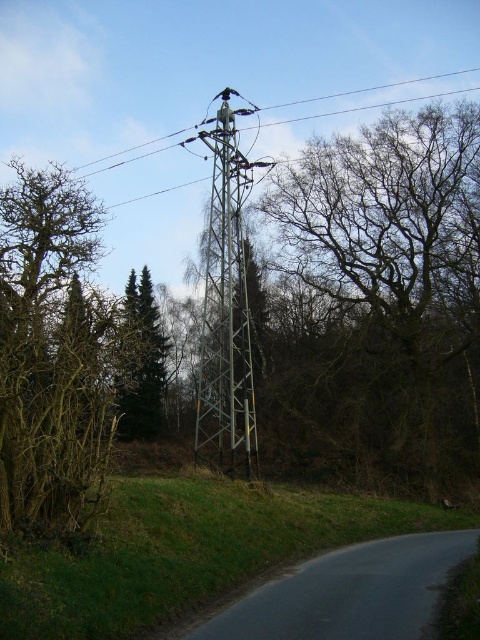
Which is behind, point (452, 205) or point (146, 266)?

The point (146, 266) is more distant.

Is point (363, 428) behind point (122, 416)?

No, it is in front of (122, 416).

This screenshot has width=480, height=640. What are the coordinates of `bare branches at center` in the screenshot? It's located at (391, 285).

Who is positioned more to the right, brown/dry wood at left or green matte tree at center-left?

green matte tree at center-left

Which is above, brown/dry wood at left or green matte tree at center-left?

brown/dry wood at left

This screenshot has height=640, width=480. What are the coordinates of `brown/dry wood at left` in the screenshot? It's located at (56, 353).

The width and height of the screenshot is (480, 640). What do you see at coordinates (56, 353) in the screenshot?
I see `brown/dry wood at left` at bounding box center [56, 353].

Can you confirm if brown/dry wood at left is positioned below metallic gray tower at center?

No.

Between point (108, 400) and point (200, 456), which one is positioned in front?

Point (108, 400) is in front.

Identify the location of brown/dry wood at left. The image size is (480, 640). (56, 353).